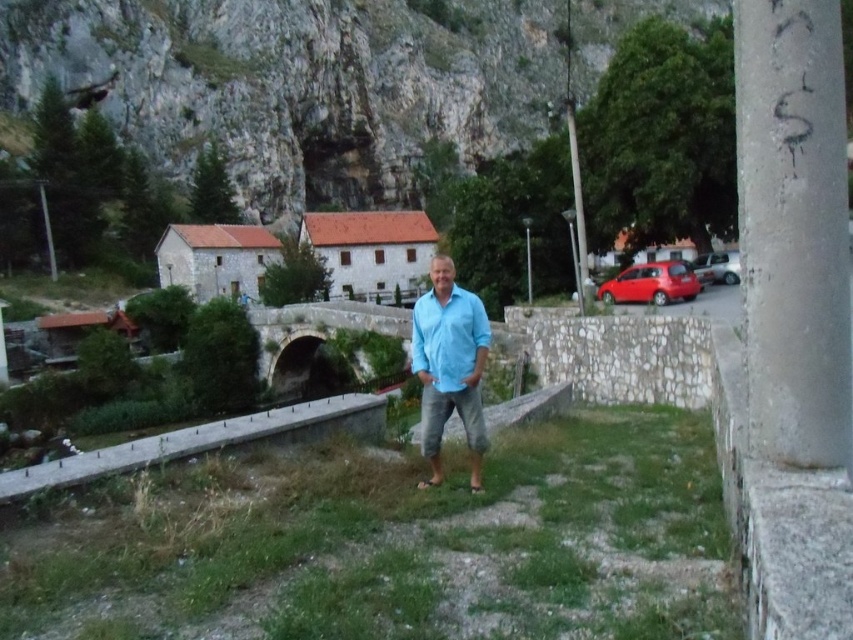
Can you confirm if green grass at center is taller than silver metallic car at right?

Yes, green grass at center is taller than silver metallic car at right.

Can you confirm if green grass at center is smaller than silver metallic car at right?

Incorrect, green grass at center is not smaller in size than silver metallic car at right.

Which is behind, point (196, 561) or point (704, 257)?

Positioned behind is point (704, 257).

Where is `green grass at center`? The width and height of the screenshot is (853, 640). green grass at center is located at coordinates (392, 544).

From the picture: Is green grass at center positioned at the back of gray concrete pillar at right?

No, it is in front of gray concrete pillar at right.

Is green grass at center smaller than gray concrete pillar at right?

Correct, green grass at center occupies less space than gray concrete pillar at right.

I want to click on green grass at center, so click(x=392, y=544).

The image size is (853, 640). I want to click on green grass at center, so click(x=392, y=544).

Is shiny red car at right positioned at the back of silver metallic car at right?

No.

Is point (689, 291) behind point (732, 275)?

No.

Which is behind, point (651, 300) or point (717, 256)?

The point (717, 256) is behind.

The image size is (853, 640). What are the coordinates of `shiny red car at right` in the screenshot? It's located at (650, 284).